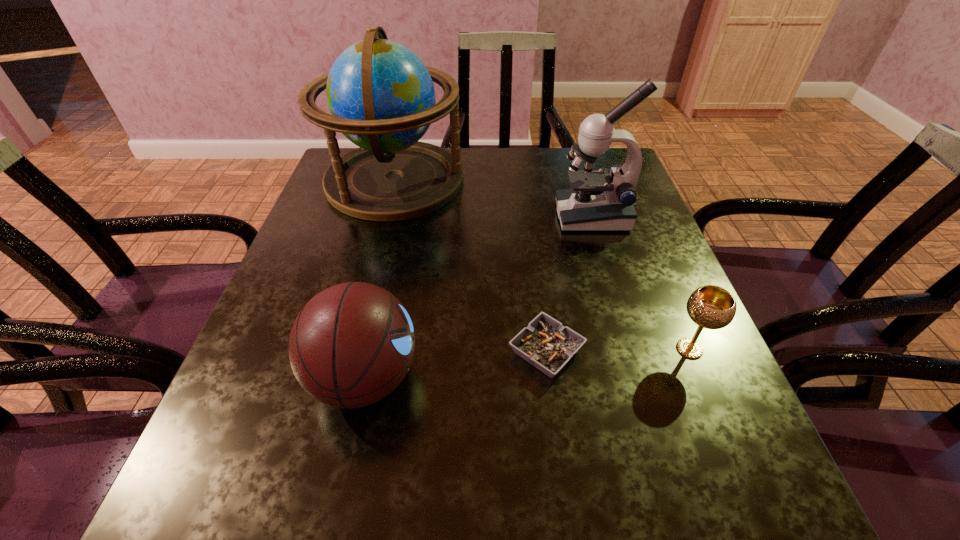
What are the coordinates of `globe` in the screenshot? It's located at (381, 97).

The width and height of the screenshot is (960, 540). In order to click on microscope in this screenshot , I will do [598, 201].

Identify the location of basketball. (352, 344).

In order to click on the second shortest object in this screenshot , I will do `click(712, 307)`.

Image resolution: width=960 pixels, height=540 pixels. I want to click on the third object from left to right, so click(x=546, y=344).

The width and height of the screenshot is (960, 540). Find the location of `ashtray`. ashtray is located at coordinates (546, 344).

The height and width of the screenshot is (540, 960). In order to click on vacant space located 0.080m on the front of the globe in this screenshot , I will do 378,244.

At what (x,y) coordinates should I click in order to perform the action: click on free point located 0.240m on the back of the microscope. Please return your answer as a coordinate pair (x, y). The image size is (960, 540). Looking at the image, I should click on (573, 153).

The width and height of the screenshot is (960, 540). Find the location of `vacant space located on the back of the basketball`. vacant space located on the back of the basketball is located at coordinates (396, 234).

Locate an element on the screen. vacant space positioned 0.080m on the back of the second shortest object is located at coordinates (669, 301).